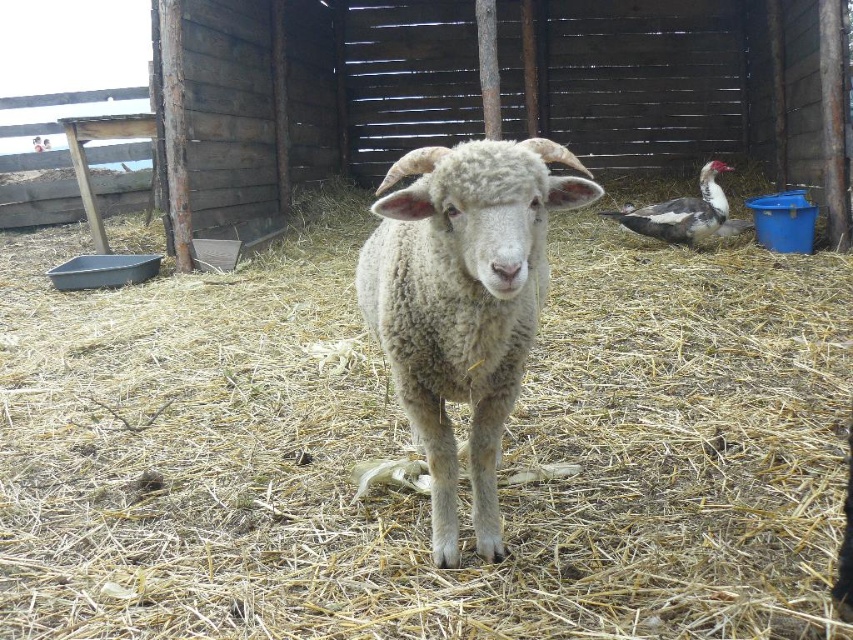
Question: Among these points, which one is farthest from the camera?

Choices:
 (A) (635, 588)
 (B) (579, 198)

Answer: (A)

Question: Is fibrous straw at center bigger than white woolly lamb at center?

Choices:
 (A) no
 (B) yes

Answer: (B)

Question: Does fibrous straw at center have a smaller size compared to white woolly lamb at center?

Choices:
 (A) no
 (B) yes

Answer: (A)

Question: Which point is farther to the camera?

Choices:
 (A) (453, 301)
 (B) (461, 609)

Answer: (B)

Question: Can you confirm if fibrous straw at center is positioned above white woolly lamb at center?

Choices:
 (A) yes
 (B) no

Answer: (A)